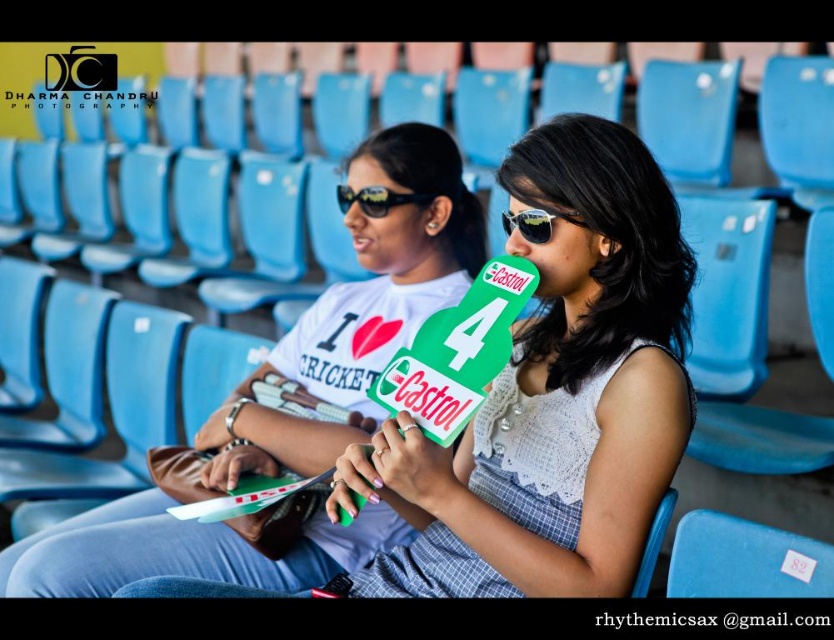
Can you confirm if white fabric shirt at center is positioned below sunglasses at center?

Yes.

Who is more forward, (372, 282) or (546, 212)?

Point (546, 212) is in front.

This screenshot has height=640, width=834. What are the coordinates of `white fabric shirt at center` in the screenshot? It's located at pos(290,404).

Is black reflective sunglasses at center above sunglasses at center?

Yes, black reflective sunglasses at center is above sunglasses at center.

Between black reflective sunglasses at center and sunglasses at center, which one appears on the left side from the viewer's perspective?

black reflective sunglasses at center

This screenshot has width=834, height=640. What do you see at coordinates (375, 198) in the screenshot?
I see `black reflective sunglasses at center` at bounding box center [375, 198].

I want to click on black reflective sunglasses at center, so click(375, 198).

Is white fabric shirt at center wider than black reflective sunglasses at center?

Yes, white fabric shirt at center is wider than black reflective sunglasses at center.

Does white fabric shirt at center have a larger size compared to black reflective sunglasses at center?

Indeed, white fabric shirt at center has a larger size compared to black reflective sunglasses at center.

Does point (4, 573) come in front of point (398, 195)?

Yes, it is.

This screenshot has height=640, width=834. In order to click on white fabric shirt at center in this screenshot , I will do `click(290, 404)`.